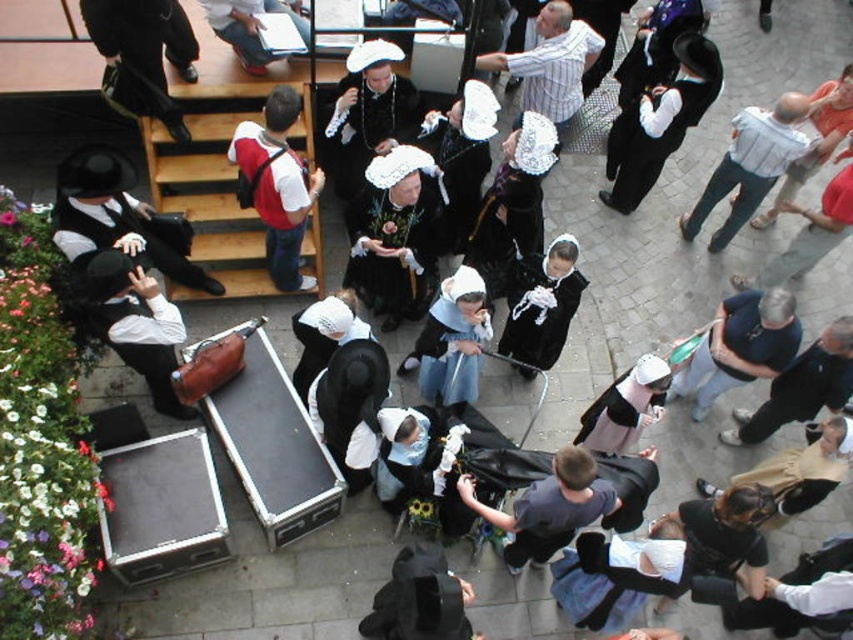
Question: Does matte black hat at left appear on the right side of white cotton shirt at upper right?

Choices:
 (A) no
 (B) yes

Answer: (A)

Question: Does matte black hat at left appear under striped cotton shirt at center?

Choices:
 (A) yes
 (B) no

Answer: (A)

Question: Which object is farther from the camera taking this photo?

Choices:
 (A) matte black hat at left
 (B) white cotton shirt at upper right
 (C) striped cotton shirt at center

Answer: (C)

Question: Which object appears farthest from the camera in this image?

Choices:
 (A) striped cotton shirt at center
 (B) white cotton shirt at upper right

Answer: (A)

Question: Considering the real-world distances, which object is closest to the matte black hat at left?

Choices:
 (A) striped cotton shirt at center
 (B) white cotton shirt at upper right

Answer: (A)

Question: Is matte black hat at left positioned in front of striped cotton shirt at center?

Choices:
 (A) yes
 (B) no

Answer: (A)